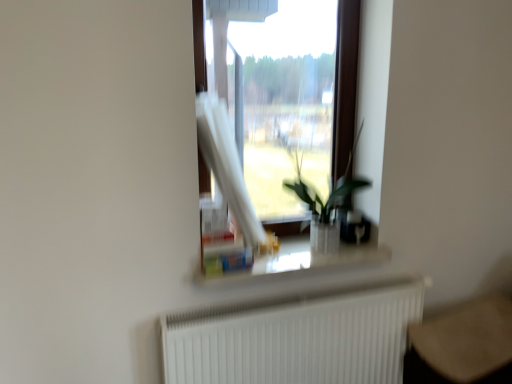
Question: Would you say white matte radiator at lower center is inside or outside transparent glass window at center?

Choices:
 (A) outside
 (B) inside

Answer: (A)

Question: From the image's perspective, relative to transparent glass window at center, is white matte radiator at lower center above or below?

Choices:
 (A) above
 (B) below

Answer: (B)

Question: Estimate the real-world distances between objects in this image. Which object is closer to the white glossy window sill at center?

Choices:
 (A) green leafy plant at center
 (B) white matte radiator at lower center
 (C) transparent glass window at center

Answer: (A)

Question: Which of these objects is positioned closest to the green leafy plant at center?

Choices:
 (A) white glossy window sill at center
 (B) white matte radiator at lower center
 (C) transparent glass window at center

Answer: (A)